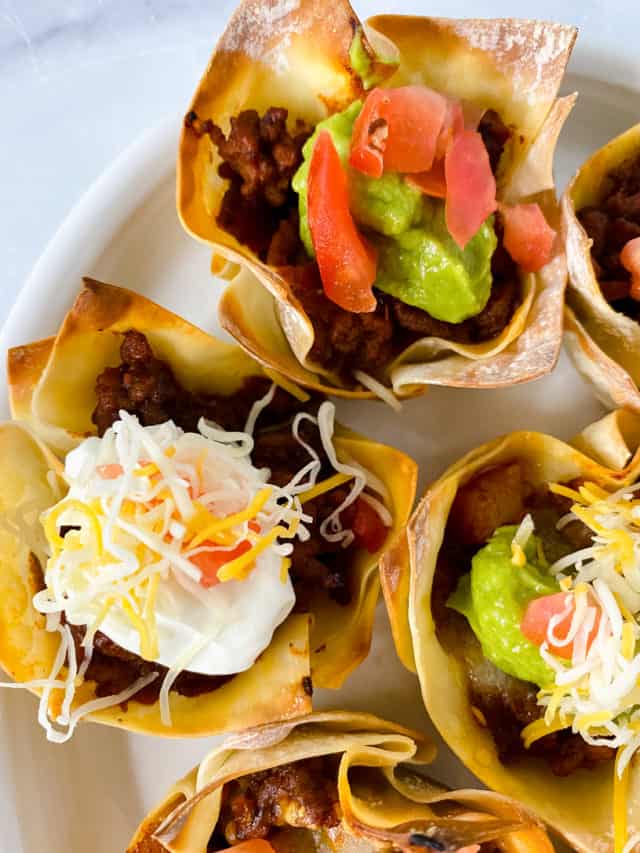
Image resolution: width=640 pixels, height=853 pixels. Identify the location of table. (68, 103).